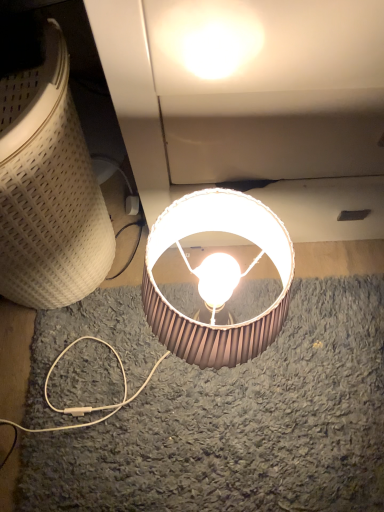
Question: Is matte white lampshade at lower left, the 2th lamp positioned from the right, bigger or smaller than metallic silver lampshade at center, placed as the second lamp when sorted from left to right?

Choices:
 (A) big
 (B) small

Answer: (A)

Question: From the image's perspective, is matte white lampshade at lower left, placed as the 1th lamp when sorted from left to right, above or below metallic silver lampshade at center, placed as the second lamp when sorted from left to right?

Choices:
 (A) above
 (B) below

Answer: (A)

Question: Is point (91, 244) closer or farther from the camera than point (183, 215)?

Choices:
 (A) farther
 (B) closer

Answer: (A)

Question: Is point (190, 321) positioned closer to the camera than point (49, 34)?

Choices:
 (A) closer
 (B) farther

Answer: (A)

Question: Is metallic silver lampshade at center, the 1th lamp when ordered from right to left, situated inside matte white lampshade at lower left, placed as the 1th lamp when sorted from left to right, or outside?

Choices:
 (A) outside
 (B) inside

Answer: (A)

Question: Visually, is metallic silver lampshade at center, placed as the second lamp when sorted from left to right, positioned to the left or to the right of matte white lampshade at lower left, placed as the 1th lamp when sorted from left to right?

Choices:
 (A) left
 (B) right

Answer: (B)

Question: Considering the positions of metallic silver lampshade at center, placed as the second lamp when sorted from left to right, and matte white lampshade at lower left, the 2th lamp positioned from the right, in the image, is metallic silver lampshade at center, placed as the second lamp when sorted from left to right, taller or shorter than matte white lampshade at lower left, the 2th lamp positioned from the right,?

Choices:
 (A) tall
 (B) short

Answer: (B)